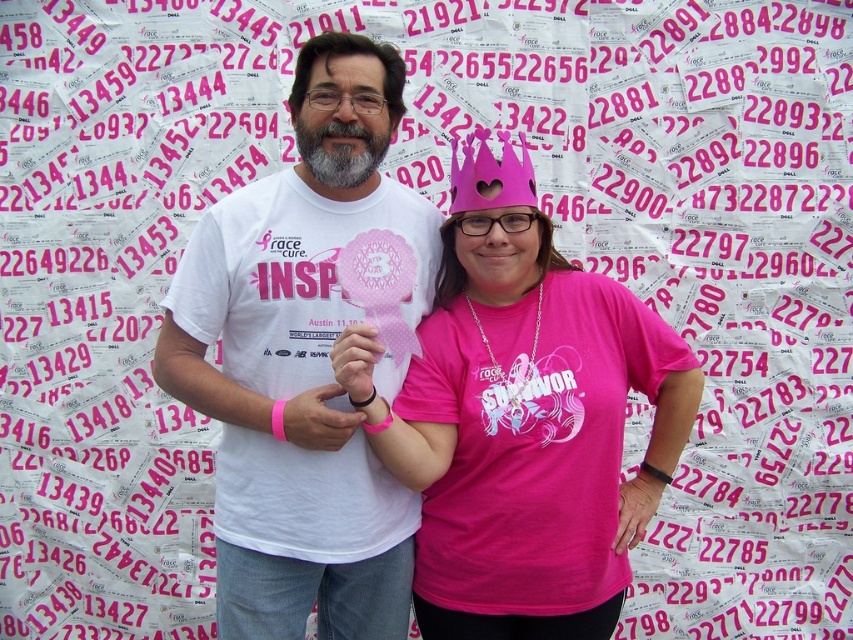
Question: Which of the following is the farthest from the observer?

Choices:
 (A) pink matte paper crown at center
 (B) white matte t-shirt at center

Answer: (B)

Question: Where is pink matte paper crown at center located in relation to white matte t-shirt at center in the image?

Choices:
 (A) left
 (B) right

Answer: (B)

Question: Which point is farther from the camera taking this photo?

Choices:
 (A) (463, 620)
 (B) (370, 138)

Answer: (B)

Question: Is pink matte paper crown at center bigger than white matte t-shirt at center?

Choices:
 (A) no
 (B) yes

Answer: (B)

Question: Does pink matte paper crown at center appear on the right side of white matte t-shirt at center?

Choices:
 (A) yes
 (B) no

Answer: (A)